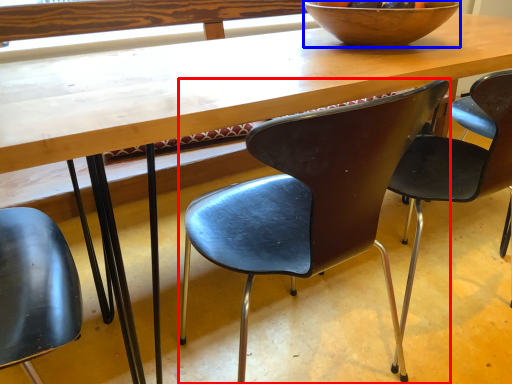
Question: Which point is further to the camera, chair (highlighted by a red box) or bowl (highlighted by a blue box)?

Choices:
 (A) chair
 (B) bowl

Answer: (B)